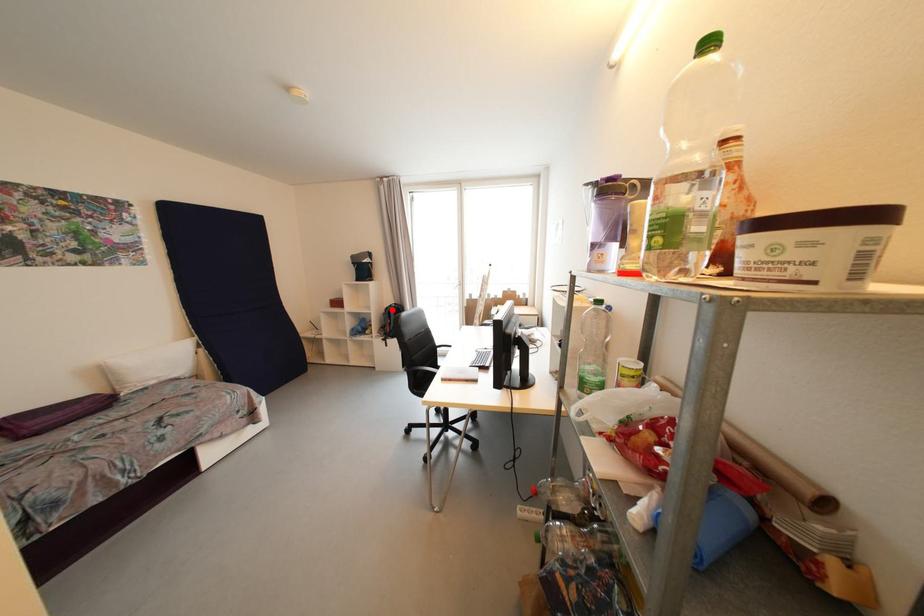
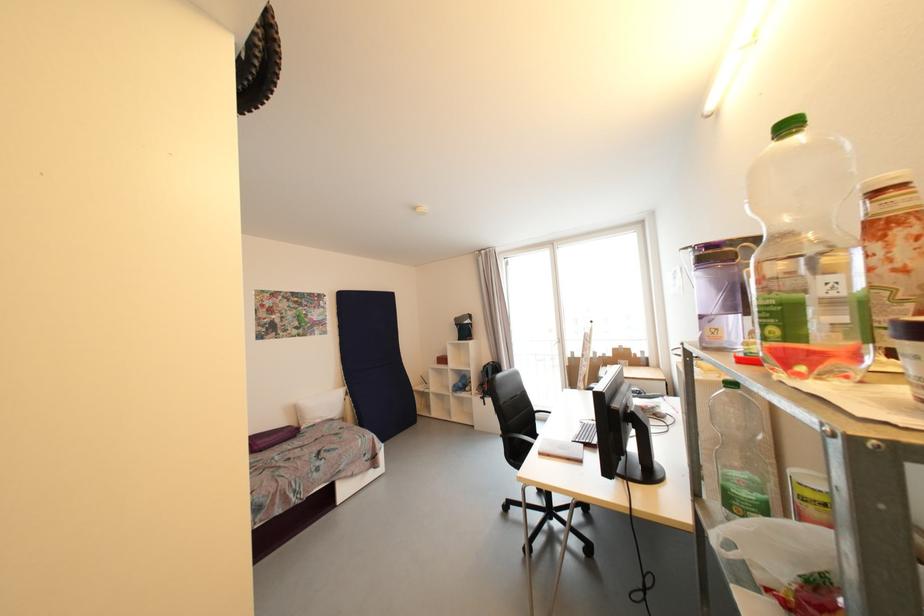
Locate, in the second image, the point that corresponds to the highlighted location in the first image.

(490, 368)